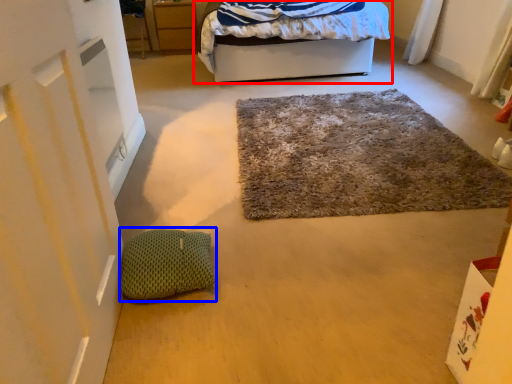
Question: Which of the following is the closest to the observer, bed (highlighted by a red box) or pillow (highlighted by a blue box)?

Choices:
 (A) bed
 (B) pillow

Answer: (B)